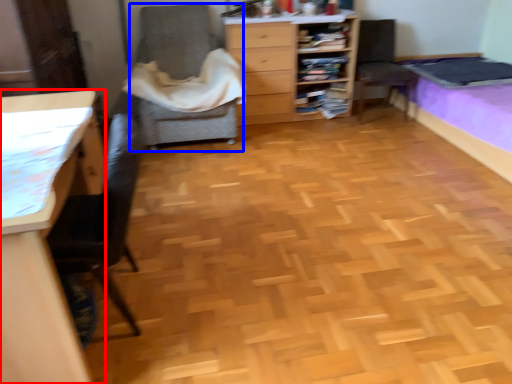
Question: Among these objects, which one is farthest to the camera, desk (highlighted by a red box) or chair (highlighted by a blue box)?

Choices:
 (A) desk
 (B) chair

Answer: (B)